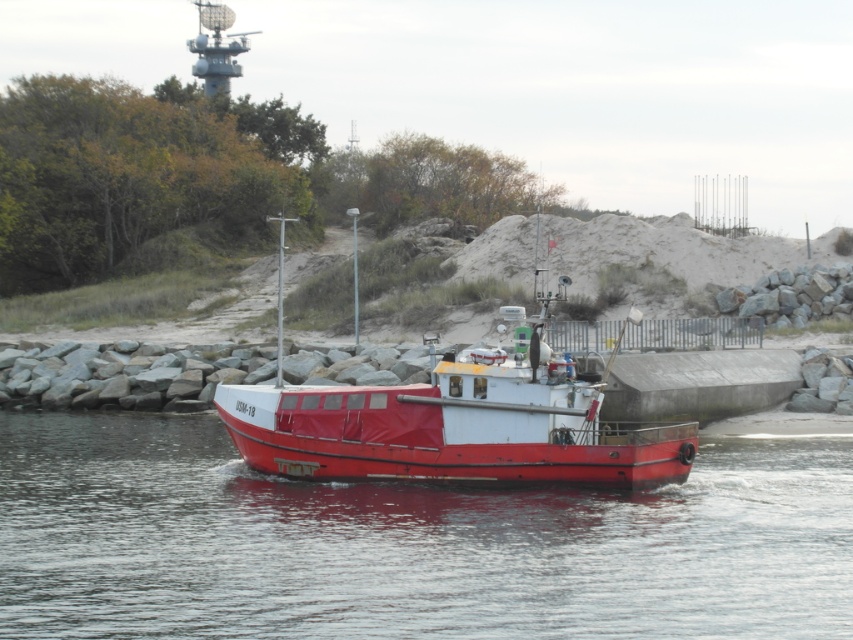
Measure the distance from smooth water at boat center to red matte boat at center.

They are 13.54 feet apart.

Is point (529, 512) positioned in front of point (535, 369)?

Yes, point (529, 512) is closer to viewer.

What are the coordinates of `smooth water at boat center` in the screenshot? It's located at (405, 545).

At what (x,y) coordinates should I click in order to perform the action: click on smooth water at boat center. Please return your answer as a coordinate pair (x, y). This screenshot has width=853, height=640. Looking at the image, I should click on (405, 545).